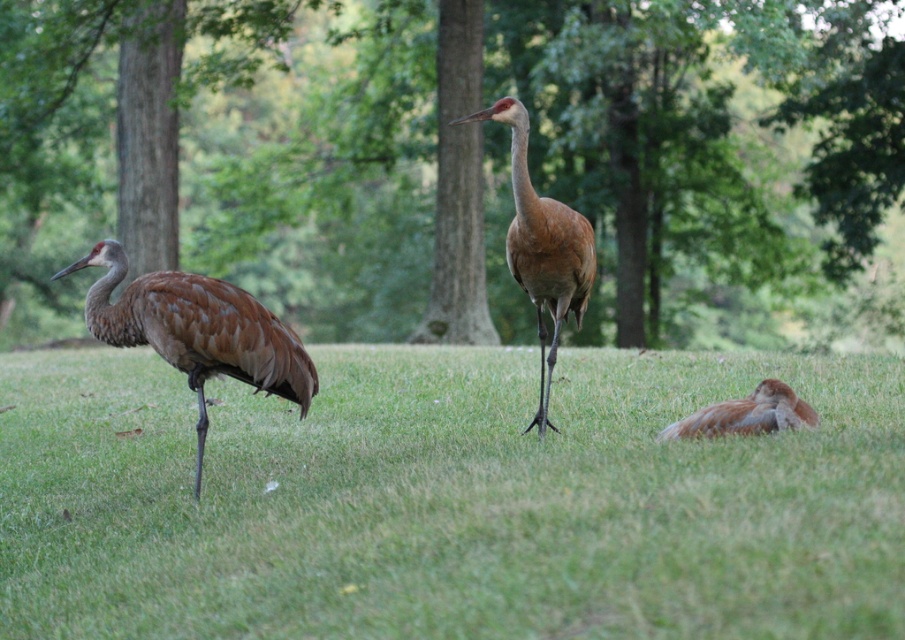
Who is shorter, brown textured tree at center or green grass at center?

green grass at center is shorter.

Does point (329, 42) lie in front of point (526, 632)?

No, (329, 42) is behind (526, 632).

Which is in front, point (643, 273) or point (641, 374)?

Point (641, 374) is in front.

Locate an element on the screen. This screenshot has height=640, width=905. brown textured tree at center is located at coordinates (451, 156).

Measure the distance between point (197,376) and camera.

They are 22.87 feet apart.

Does brown feathered crane at left appear on the left side of brown feathered bird at lower right?

Indeed, brown feathered crane at left is positioned on the left side of brown feathered bird at lower right.

Is point (224, 349) more distant than point (780, 397)?

Yes, it is behind point (780, 397).

What are the coordinates of `brown feathered crane at left` in the screenshot? It's located at (196, 330).

Who is shorter, brown textured tree at center or brown feathered crane at left?

brown feathered crane at left

Is point (332, 188) less distant than point (148, 333)?

That is False.

The height and width of the screenshot is (640, 905). I want to click on brown textured tree at center, so click(x=451, y=156).